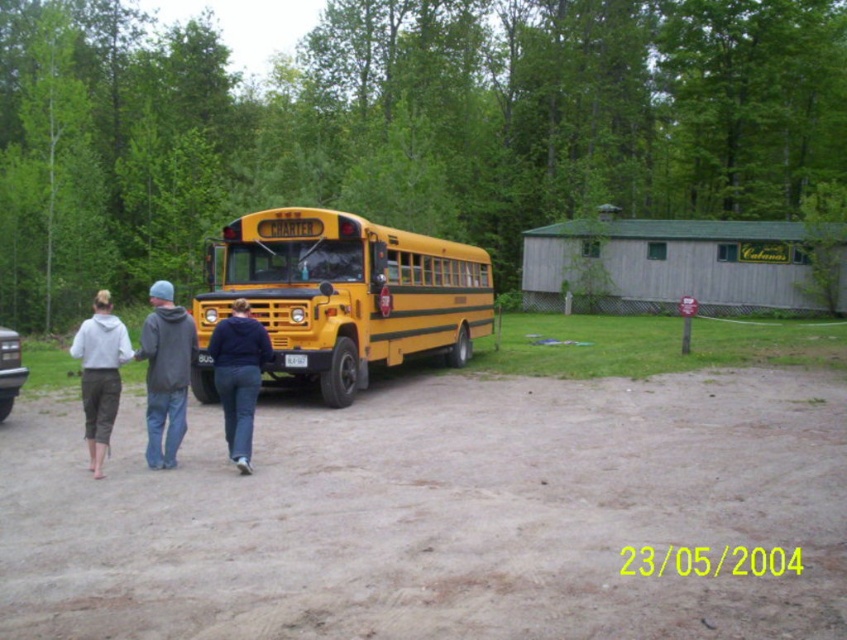
Who is higher up, yellow matte bus at center or matte gray hoodie at lower left?

yellow matte bus at center is above.

Is yellow matte bus at center above matte gray hoodie at lower left?

Yes.

Is point (202, 336) less distant than point (129, 358)?

No, (202, 336) is behind (129, 358).

I want to click on yellow matte bus at center, so click(x=342, y=296).

Does gray hoodie at center have a greater width compared to navy blue hoodie at center?

Correct, the width of gray hoodie at center exceeds that of navy blue hoodie at center.

Is gray hoodie at center positioned behind navy blue hoodie at center?

No.

Which is behind, point (172, 324) or point (234, 458)?

Point (234, 458)

Locate an element on the screen. gray hoodie at center is located at coordinates (165, 372).

From the picture: Is navy blue hoodie at center positioned before matte gray hoodie at lower left?

No, it is behind matte gray hoodie at lower left.

Describe the element at coordinates (237, 376) in the screenshot. This screenshot has width=847, height=640. I see `navy blue hoodie at center` at that location.

Where is `navy blue hoodie at center`? navy blue hoodie at center is located at coordinates (237, 376).